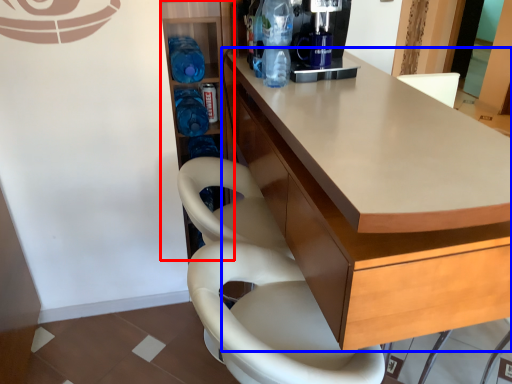
Question: Which object appears farthest to the camera in this image, shelf (highlighted by a red box) or cabinetry (highlighted by a blue box)?

Choices:
 (A) shelf
 (B) cabinetry

Answer: (A)